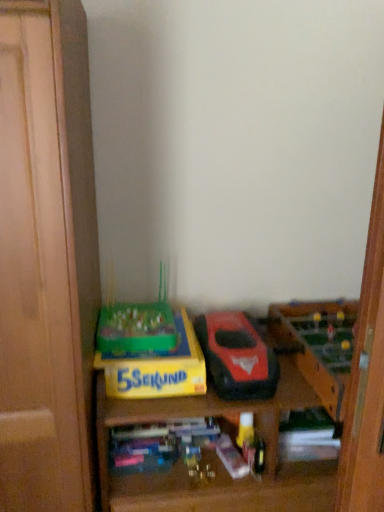
Question: Is shiny red plastic toy car at center facing away from yellow cardboard box at lower center?

Choices:
 (A) yes
 (B) no

Answer: (B)

Question: Considering the relative positions of shiny red plastic toy car at center and yellow cardboard box at lower center in the image provided, is shiny red plastic toy car at center to the right of yellow cardboard box at lower center from the viewer's perspective?

Choices:
 (A) no
 (B) yes

Answer: (B)

Question: Is shiny red plastic toy car at center to the left of yellow cardboard box at lower center from the viewer's perspective?

Choices:
 (A) yes
 (B) no

Answer: (B)

Question: Can you confirm if shiny red plastic toy car at center is wider than yellow cardboard box at lower center?

Choices:
 (A) no
 (B) yes

Answer: (B)

Question: Can you confirm if shiny red plastic toy car at center is smaller than yellow cardboard box at lower center?

Choices:
 (A) yes
 (B) no

Answer: (B)

Question: From the image's perspective, is yellow cardboard box at lower center above or below green plastic game at center, positioned as the second toy in right-to-left order?

Choices:
 (A) below
 (B) above

Answer: (A)

Question: Which is correct: yellow cardboard box at lower center is inside green plastic game at center, which is the first toy in left-to-right order, or outside of it?

Choices:
 (A) outside
 (B) inside

Answer: (A)

Question: Is point (160, 353) closer or farther from the camera than point (163, 324)?

Choices:
 (A) farther
 (B) closer

Answer: (B)

Question: Looking at their shapes, would you say yellow cardboard box at lower center is wider or thinner than green plastic game at center, which is the first toy in left-to-right order?

Choices:
 (A) thin
 (B) wide

Answer: (B)

Question: Considering the positions of point (203, 488) and point (124, 350), is point (203, 488) closer or farther from the camera than point (124, 350)?

Choices:
 (A) farther
 (B) closer

Answer: (A)

Question: From the image's perspective, is wooden shelf at lower center positioned above or below green plastic game at center, positioned as the second toy in right-to-left order?

Choices:
 (A) below
 (B) above

Answer: (A)

Question: Is wooden shelf at lower center taller or shorter than green plastic game at center, positioned as the second toy in right-to-left order?

Choices:
 (A) short
 (B) tall

Answer: (B)

Question: Considering the relative positions of wooden shelf at lower center and green plastic game at center, which is the first toy in left-to-right order, in the image provided, is wooden shelf at lower center to the left or to the right of green plastic game at center, which is the first toy in left-to-right order,?

Choices:
 (A) left
 (B) right

Answer: (B)

Question: Considering their positions, is yellow cardboard box at lower center located in front of or behind shiny red plastic toy car at center?

Choices:
 (A) behind
 (B) front

Answer: (A)

Question: From the image's perspective, is yellow cardboard box at lower center above or below shiny red plastic toy car at center?

Choices:
 (A) above
 (B) below

Answer: (B)